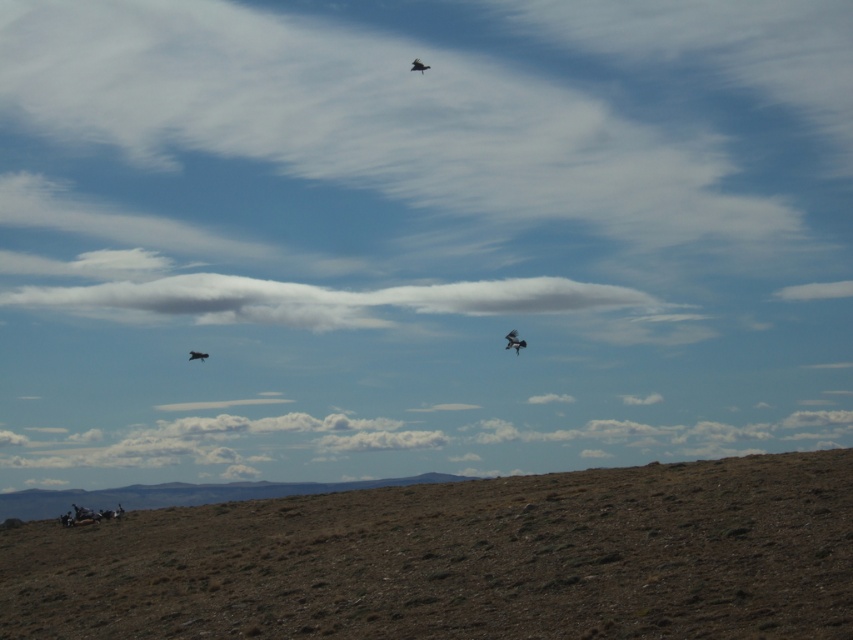
Question: Considering the relative positions of white fluffy cloud at center and dark brown feathers at upper center in the image provided, where is white fluffy cloud at center located with respect to dark brown feathers at upper center?

Choices:
 (A) above
 (B) below

Answer: (B)

Question: Is brown dirt hillside at lower center behind dark brown feathered bird at upper center?

Choices:
 (A) no
 (B) yes

Answer: (A)

Question: Estimate the real-world distances between objects in this image. Which object is closer to the dark brown feathers at upper center?

Choices:
 (A) brown dirt hillside at lower center
 (B) dark brown feathered bird at upper center

Answer: (B)

Question: Is brown dirt hillside at lower center smaller than dark brown feathers at center?

Choices:
 (A) no
 (B) yes

Answer: (A)

Question: Estimate the real-world distances between objects in this image. Which object is farther from the dark brown feathers at center?

Choices:
 (A) brown dirt hillside at lower center
 (B) dark brown feathers at upper center

Answer: (A)

Question: Which of these objects is positioned closest to the dark brown feathers at center?

Choices:
 (A) dark brown feathers at upper center
 (B) white fluffy cloud at center

Answer: (A)